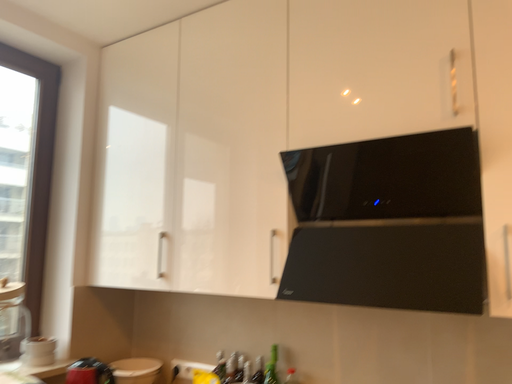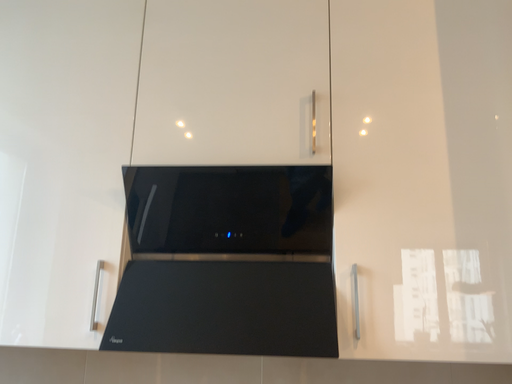
Question: Which way did the camera rotate in the video?

Choices:
 (A) rotated right
 (B) rotated left

Answer: (A)